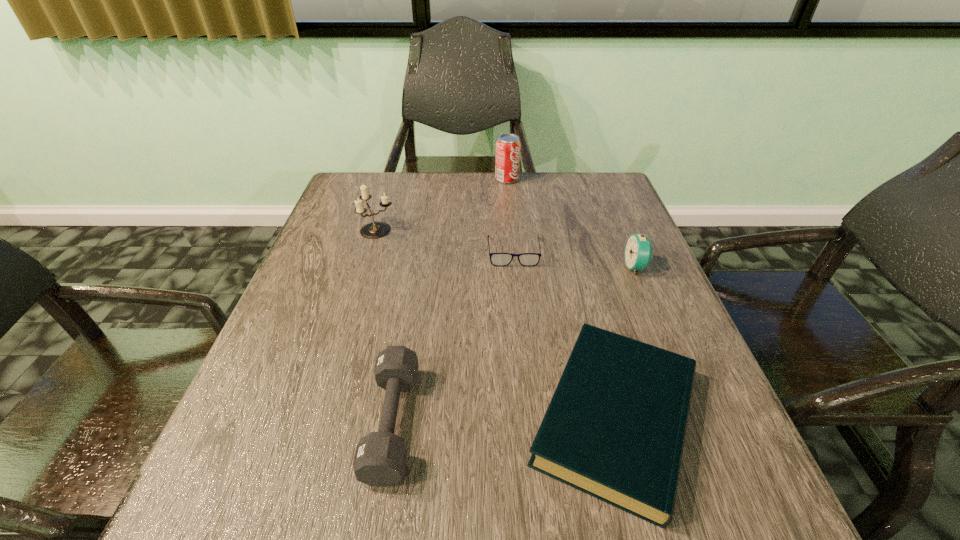
Find the location of a particular element. The width and height of the screenshot is (960, 540). the second closest object relative to the dumbbell is located at coordinates (497, 259).